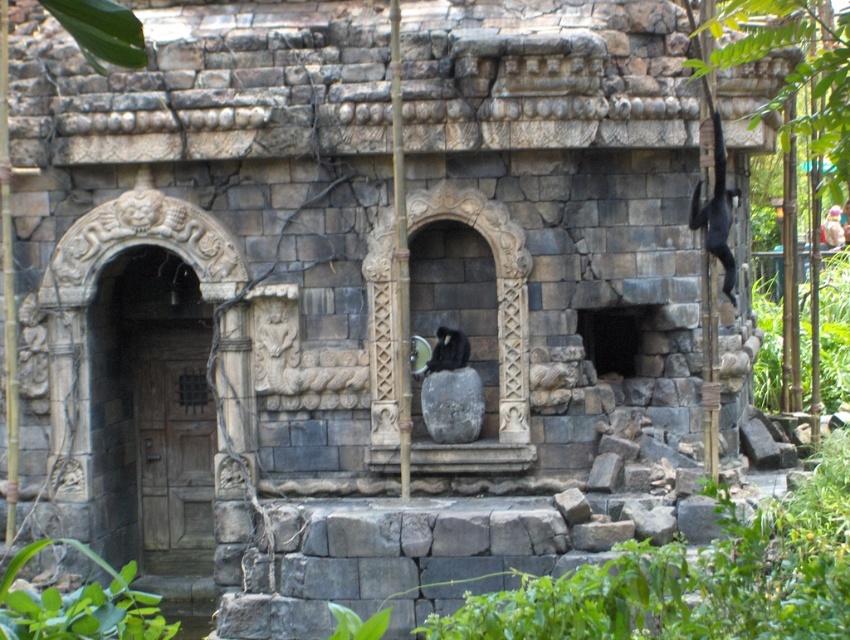
You are a gardener tasked with watering two green leafy plants in the temple courtyard. The plants are the green leafy plant at lower left and the green leafy plant at right. Which plant requires a larger watering can to cover its entire width?

The green leafy plant at right requires a larger watering can because its width is greater than the green leafy plant at lower left.